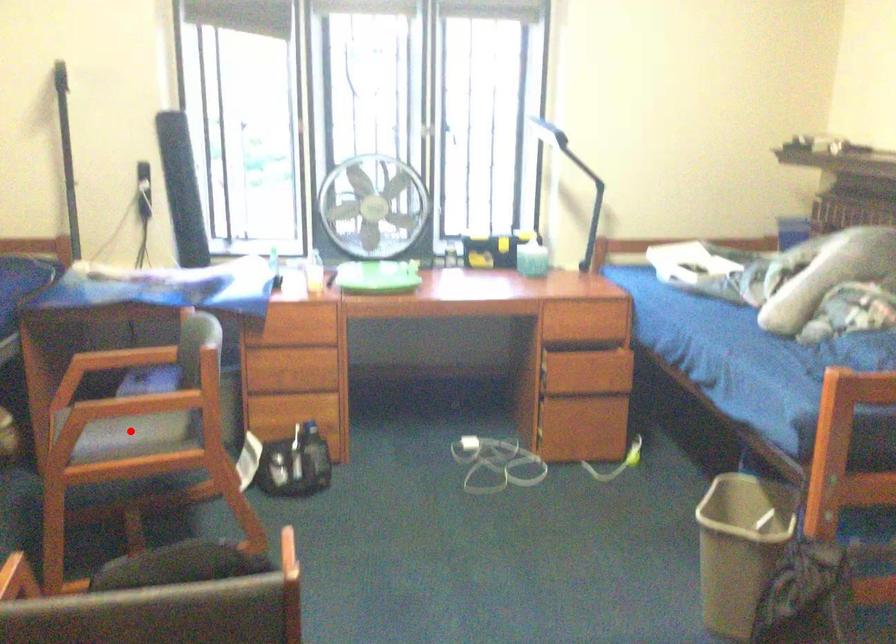
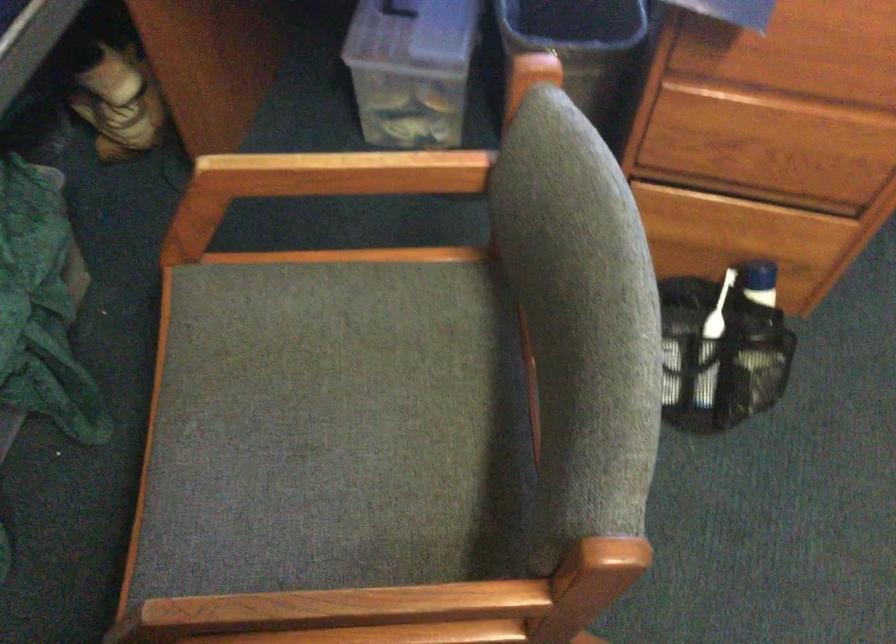
The point at the highlighted location is marked in the first image. Where is the corresponding point in the second image?

(347, 406)